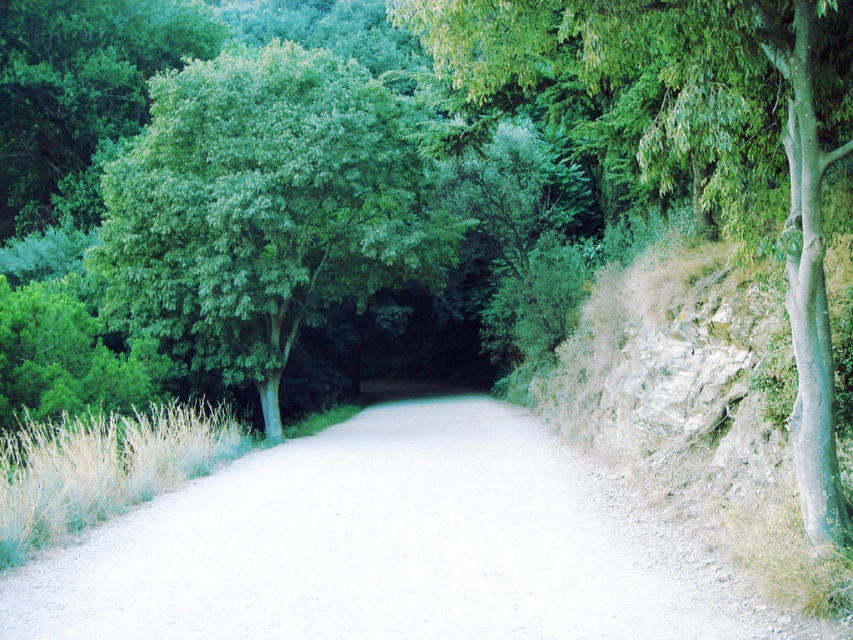
Question: Which of the following is the farthest from the observer?

Choices:
 (A) gray gravel path at center
 (B) green leafy tree at center
 (C) green leafy tree at right

Answer: (B)

Question: Can you confirm if green leafy tree at center is bigger than green leafy tree at right?

Choices:
 (A) yes
 (B) no

Answer: (A)

Question: Does gray gravel path at center appear on the right side of green leafy tree at center?

Choices:
 (A) yes
 (B) no

Answer: (A)

Question: Can you confirm if green leafy tree at center is positioned to the left of green leafy tree at right?

Choices:
 (A) no
 (B) yes

Answer: (B)

Question: Considering the real-world distances, which object is farthest from the green leafy tree at right?

Choices:
 (A) gray gravel path at center
 (B) green leafy tree at center

Answer: (B)

Question: Which object is farther from the camera taking this photo?

Choices:
 (A) green leafy tree at right
 (B) green leafy tree at center

Answer: (B)